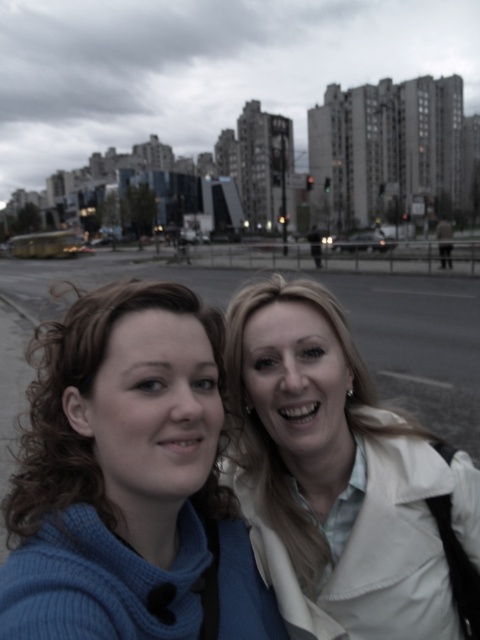
Question: Can you confirm if blue knitted sweater at center is positioned to the right of white matte jacket at center?

Choices:
 (A) yes
 (B) no

Answer: (B)

Question: Can you confirm if blue knitted sweater at center is thinner than white matte jacket at center?

Choices:
 (A) yes
 (B) no

Answer: (B)

Question: Which point is farther from the camera taking this photo?

Choices:
 (A) (313, 412)
 (B) (39, 620)

Answer: (A)

Question: Does blue knitted sweater at center have a smaller size compared to white matte jacket at center?

Choices:
 (A) no
 (B) yes

Answer: (A)